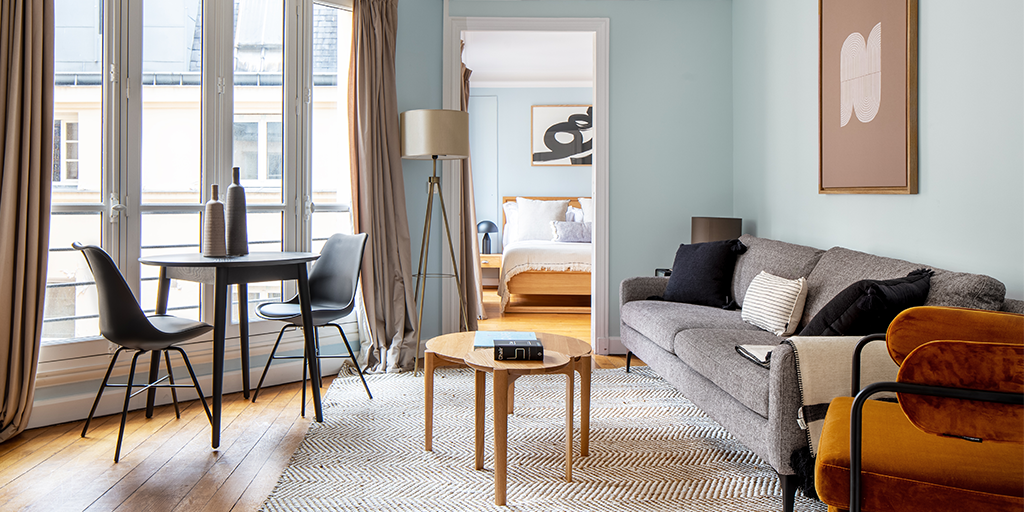
Where is `table`? Image resolution: width=1024 pixels, height=512 pixels. table is located at coordinates (271, 264).